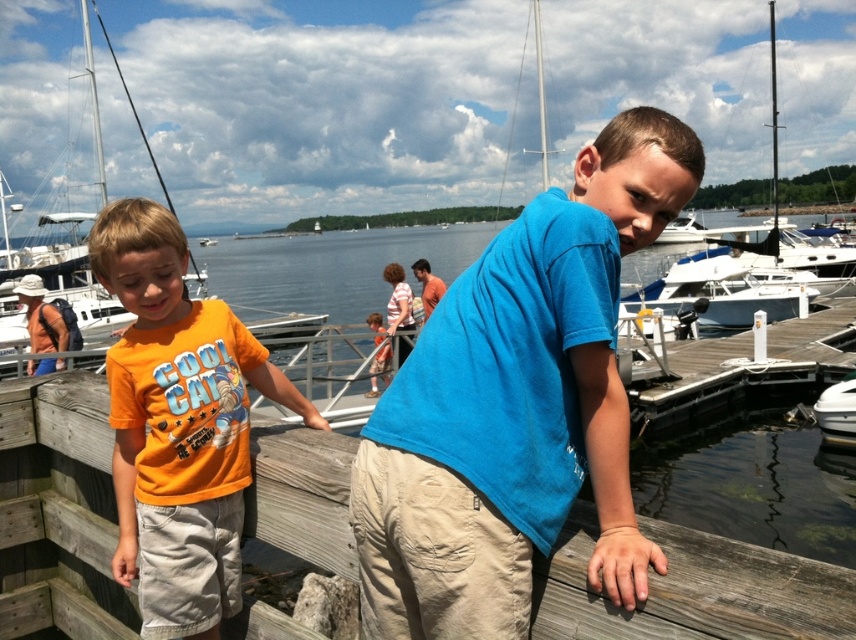
You are a photographer at the marina and want to capture a shot of the orange cotton shirt at left. Where should you position your camera to ensure the shirt is centered in the frame?

The orange cotton shirt at left is located at point (177,424), so you should position your camera to aim at that coordinate to center it in the frame.

You are a photographer trying to capture both the orange cotton shirt at left and the striped cotton shirt at center in a single frame. Based on their widths, which shirt might require you to adjust your camera angle to ensure it fits entirely in the photo?

The orange cotton shirt at left might be wider than the striped cotton shirt at center, so you might need to adjust your camera angle to accommodate its width to ensure it fits in the photo.